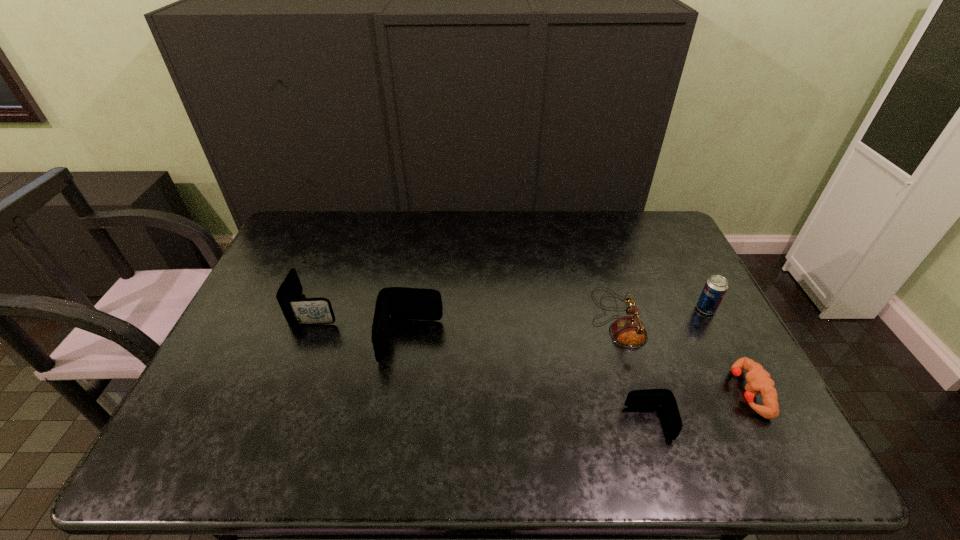
Where is `the third closest object to the shortest wallet`? Image resolution: width=960 pixels, height=540 pixels. the third closest object to the shortest wallet is located at coordinates (716, 286).

Locate an element on the screen. The height and width of the screenshot is (540, 960). object that stands as the fourth closest to the telephone is located at coordinates (393, 303).

Choose which wallet is the nearest neighbor to the puncher. Please provide its 2D coordinates. Your answer should be formatted as a tuple, i.e. [(x, y)], where the tuple contains the x and y coordinates of a point satisfying the conditions above.

[(648, 398)]

I want to click on wallet that is the second closest to the second shortest wallet, so 648,398.

Where is `vacant position in the image that satisfies the following two spatial constraints: 1. on the rotary dial of the telephone; 2. on the outer surface of the second wallet from right to left`? This screenshot has height=540, width=960. vacant position in the image that satisfies the following two spatial constraints: 1. on the rotary dial of the telephone; 2. on the outer surface of the second wallet from right to left is located at coordinates (623, 341).

You are a GUI agent. You are given a task and a screenshot of the screen. Output one action in this format:
    pyautogui.click(x=<x>, y=<y>)
    Task: Click on the vacant space that satisfies the following two spatial constraints: 1. on the rotary dial of the telephone; 2. on the outer surface of the fifth object from right to left
    
    Given the screenshot: What is the action you would take?
    pyautogui.click(x=623, y=341)